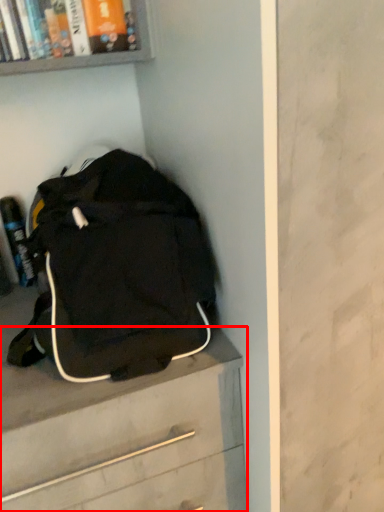
Question: Considering the relative positions of chest of drawers (annotated by the red box) and backpack in the image provided, where is chest of drawers (annotated by the red box) located with respect to the staircase?

Choices:
 (A) left
 (B) right

Answer: (A)